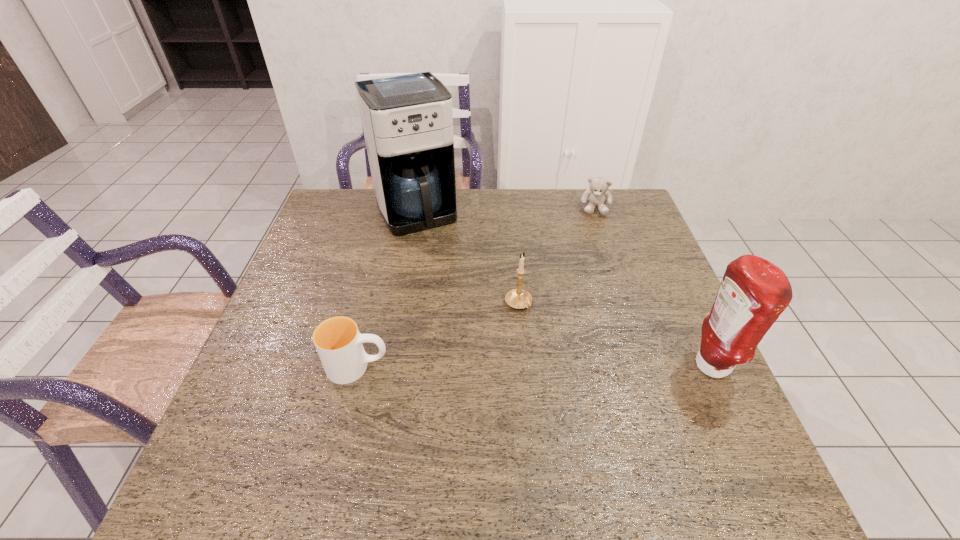
You are a GUI agent. You are given a task and a screenshot of the screen. Output one action in this format:
    pyautogui.click(x=<x>, y=<y>)
    Task: Click on the vacant space located 0.320m on the face of the teddy bear
    The image size is (960, 540).
    Given the screenshot: What is the action you would take?
    pyautogui.click(x=592, y=285)

Locate an element on the screen. The height and width of the screenshot is (540, 960). free space located 0.220m on the face of the teddy bear is located at coordinates (593, 261).

Where is `vacant space located 0.400m on the front panel of the tallest object`? This screenshot has width=960, height=540. vacant space located 0.400m on the front panel of the tallest object is located at coordinates (478, 334).

This screenshot has height=540, width=960. I want to click on free spot located on the front panel of the tallest object, so click(473, 325).

Where is `vacant area located 0.280m on the front panel of the tallest object`? The image size is (960, 540). vacant area located 0.280m on the front panel of the tallest object is located at coordinates (461, 301).

The width and height of the screenshot is (960, 540). I want to click on vacant space located on the handle side of the third nearest object, so click(540, 330).

The height and width of the screenshot is (540, 960). What are the coordinates of `blank space located 0.290m on the handle side of the third nearest object` in the screenshot? It's located at (602, 404).

Locate an element on the screen. blank area located 0.110m on the handle side of the third nearest object is located at coordinates (552, 345).

At what (x,y) coordinates should I click in order to perform the action: click on teddy bear present at the far edge. Please return your answer as a coordinate pair (x, y). The width and height of the screenshot is (960, 540). Looking at the image, I should click on (596, 196).

Locate an element on the screen. This screenshot has width=960, height=540. coffee maker at the far edge is located at coordinates (407, 119).